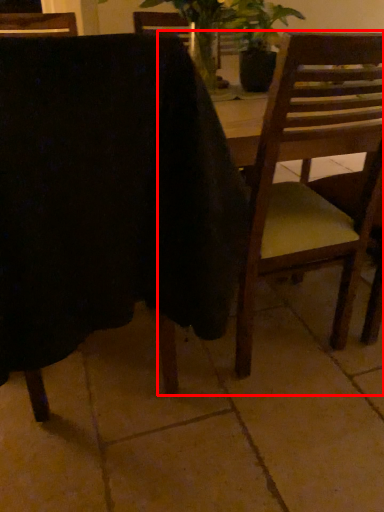
Question: From the image, what is the correct spatial relationship of chair (annotated by the red box) in relation to chair?

Choices:
 (A) left
 (B) right

Answer: (B)